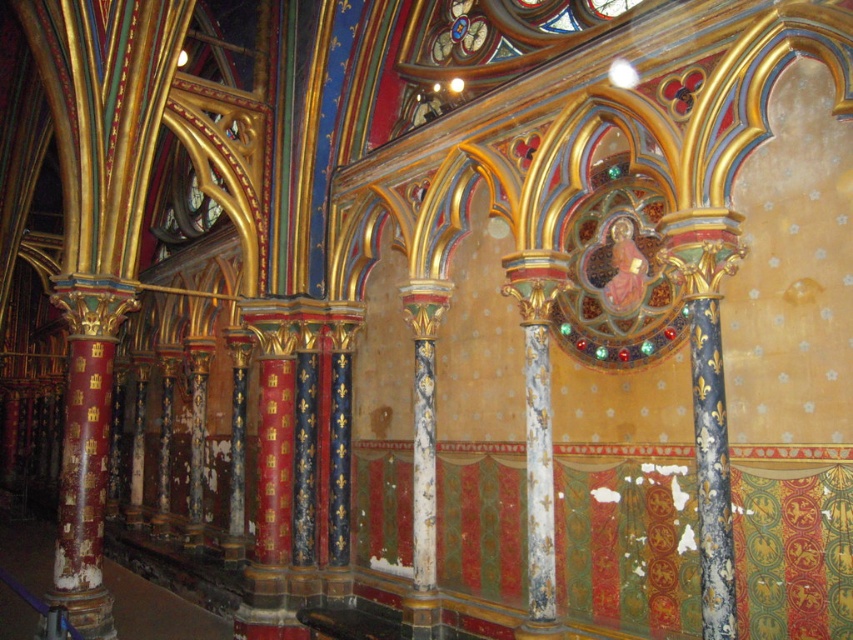
Question: Is the position of white painted wood column at center more distant than that of white painted stone column at center?

Choices:
 (A) yes
 (B) no

Answer: (B)

Question: Does white painted wood column at center have a smaller size compared to white painted stone column at center?

Choices:
 (A) no
 (B) yes

Answer: (A)

Question: Considering the relative positions of white painted wood column at center and white painted stone column at center in the image provided, where is white painted wood column at center located with respect to white painted stone column at center?

Choices:
 (A) below
 (B) above

Answer: (B)

Question: Among these objects, which one is farthest from the camera?

Choices:
 (A) white painted wood column at center
 (B) white painted stone column at center

Answer: (B)